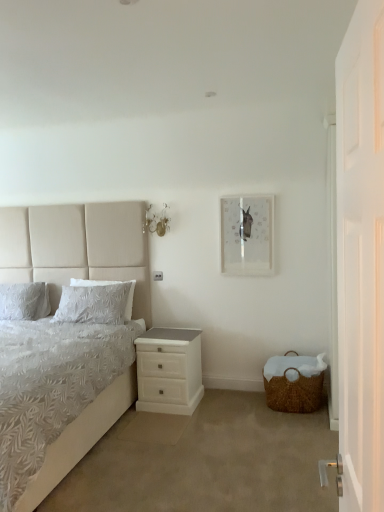
Measure the distance between point (348, 221) and camera.

Point (348, 221) and camera are 1.08 meters apart from each other.

This screenshot has width=384, height=512. I want to click on white glossy nightstand at lower center, so click(x=169, y=370).

I want to click on white textured bed at left, so click(77, 248).

What do you see at coordinates (77, 248) in the screenshot?
I see `white textured bed at left` at bounding box center [77, 248].

What do you see at coordinates (24, 301) in the screenshot?
I see `white textured pillow at left, which appears as the second pillow when viewed from the right` at bounding box center [24, 301].

In the scene shown: In order to face clear glass picture frame at upper center, should I rotate leftwards or rightwards?

To align with it, rotate right about 7.191°.

Locate an element on the screen. The width and height of the screenshot is (384, 512). white wooden door at right is located at coordinates (361, 256).

From a real-world perspective, relative to white textured pillow at left, which is counted as the 1th pillow, starting from the left, is white wooden door at right vertically above or below?

In terms of real-world spatial position, white wooden door at right is above white textured pillow at left, which is counted as the 1th pillow, starting from the left.

Consider the image. Is white wooden door at right shorter than white textured pillow at left, which is counted as the 1th pillow, starting from the left?

In fact, white wooden door at right may be taller than white textured pillow at left, which is counted as the 1th pillow, starting from the left.

Can we say white wooden door at right lies outside white textured pillow at left, which is counted as the 1th pillow, starting from the left?

That's correct, white wooden door at right is outside of white textured pillow at left, which is counted as the 1th pillow, starting from the left.

From the image's perspective, who appears lower, white wooden door at right or white textured pillow at left, which appears as the second pillow when viewed from the right?

From the image's view, white textured pillow at left, which appears as the second pillow when viewed from the right, is below.

Considering the sizes of woven brown basket at lower right and white textured pillow at left, which appears as the second pillow when viewed from the right, in the image, is woven brown basket at lower right taller or shorter than white textured pillow at left, which appears as the second pillow when viewed from the right,?

Considering their sizes, woven brown basket at lower right has less height than white textured pillow at left, which appears as the second pillow when viewed from the right.

From a real-world perspective, count 2nd pillows upward from the woven brown basket at lower right and point to it. Please provide its 2D coordinates.

[(24, 301)]

Looking at this image, from the image's perspective, is woven brown basket at lower right below white textured pillow at left, which appears as the second pillow when viewed from the right?

Yes, from the image's perspective, woven brown basket at lower right is below white textured pillow at left, which appears as the second pillow when viewed from the right.

Based on the photo, could you tell me if woven brown basket at lower right is facing white textured pillow at left, which is counted as the 1th pillow, starting from the left?

No, woven brown basket at lower right is not oriented towards white textured pillow at left, which is counted as the 1th pillow, starting from the left.

In terms of size, does woven brown basket at lower right appear bigger or smaller than white textured pillow at left, the first pillow when ordered from right to left?

Considering their sizes, woven brown basket at lower right takes up more space than white textured pillow at left, the first pillow when ordered from right to left.

Is woven brown basket at lower right directly adjacent to white textured pillow at left, which is counted as the second pillow, starting from the left?

No, woven brown basket at lower right is not making contact with white textured pillow at left, which is counted as the second pillow, starting from the left.

Is woven brown basket at lower right shorter than white textured pillow at left, which is counted as the second pillow, starting from the left?

Yes, woven brown basket at lower right is shorter than white textured pillow at left, which is counted as the second pillow, starting from the left.

Is clear glass picture frame at upper center aimed at white wooden door at right?

Yes, clear glass picture frame at upper center is facing white wooden door at right.

Considering the relative sizes of clear glass picture frame at upper center and white wooden door at right in the image provided, is clear glass picture frame at upper center taller than white wooden door at right?

In fact, clear glass picture frame at upper center may be shorter than white wooden door at right.

Is white wooden door at right completely or partially inside clear glass picture frame at upper center?

No, clear glass picture frame at upper center does not contain white wooden door at right.

Can you see clear glass picture frame at upper center touching white wooden door at right?

No, clear glass picture frame at upper center is not with white wooden door at right.

From the image's perspective, which one is positioned lower, white textured bed at left or white textured pillow at left, which appears as the second pillow when viewed from the right?

white textured bed at left.

Is white textured pillow at left, which appears as the second pillow when viewed from the right, at the back of white textured bed at left?

Correct, white textured bed at left is looking away from white textured pillow at left, which appears as the second pillow when viewed from the right.

Does white textured bed at left touch white textured pillow at left, which is counted as the 1th pillow, starting from the left?

They are not placed beside each other.

What's the angular difference between white textured pillow at left, which appears as the second pillow when viewed from the right, and white wooden door at right's facing directions?

white textured pillow at left, which appears as the second pillow when viewed from the right, and white wooden door at right are facing 85.2 degrees away from each other.

Is white textured pillow at left, which appears as the second pillow when viewed from the right, spatially inside white wooden door at right, or outside of it?

white textured pillow at left, which appears as the second pillow when viewed from the right, cannot be found inside white wooden door at right.

Considering their positions, is white textured pillow at left, which appears as the second pillow when viewed from the right, located in front of or behind white wooden door at right?

Clearly, white textured pillow at left, which appears as the second pillow when viewed from the right, is behind white wooden door at right.

Does point (39, 303) come behind point (361, 210)?

Yes, it is behind point (361, 210).

Considering the relative sizes of white textured bed at left and woven brown basket at lower right in the image provided, is white textured bed at left smaller than woven brown basket at lower right?

No.

From the image's perspective, between white textured bed at left and woven brown basket at lower right, who is located below?

woven brown basket at lower right is shown below in the image.

Is white textured bed at left to the left of woven brown basket at lower right from the viewer's perspective?

Yes, white textured bed at left is to the left of woven brown basket at lower right.

Which is farther, (41, 495) or (281, 376)?

The point (281, 376) is farther.

At what (x,y) coordinates should I click in order to perform the action: click on the 2nd pillow below the white wooden door at right (from the image's perspective). Please return your answer as a coordinate pair (x, y). Image resolution: width=384 pixels, height=512 pixels. Looking at the image, I should click on (24, 301).

This screenshot has height=512, width=384. I want to click on pillow that is the 2nd one when counting backward from the woven brown basket at lower right, so click(24, 301).

From the image, which object appears to be farther from white textured pillow at left, which is counted as the second pillow, starting from the left, white textured pillow at left, which appears as the second pillow when viewed from the right, or white glossy nightstand at lower center?

white glossy nightstand at lower center lies further to white textured pillow at left, which is counted as the second pillow, starting from the left, than the other object.

Looking at this image, considering their positions, is white textured pillow at left, which appears as the second pillow when viewed from the right, positioned further to woven brown basket at lower right than white wooden door at right?

The object further to woven brown basket at lower right is white wooden door at right.

Considering their positions, is white glossy nightstand at lower center positioned closer to clear glass picture frame at upper center than white wooden door at right?

white glossy nightstand at lower center.

Based on their spatial positions, is white wooden door at right or white textured pillow at left, which appears as the second pillow when viewed from the right, closer to clear glass picture frame at upper center?

white textured pillow at left, which appears as the second pillow when viewed from the right, is closer to clear glass picture frame at upper center.

Looking at the image, which one is located further to white textured pillow at left, which is counted as the second pillow, starting from the left, white textured bed at left or white glossy nightstand at lower center?

white glossy nightstand at lower center is further to white textured pillow at left, which is counted as the second pillow, starting from the left.

Looking at the image, which one is located further to clear glass picture frame at upper center, white textured pillow at left, which is counted as the 1th pillow, starting from the left, or white textured bed at left?

white textured pillow at left, which is counted as the 1th pillow, starting from the left, lies further to clear glass picture frame at upper center than the other object.

Based on their spatial positions, is white textured bed at left or white wooden door at right closer to white glossy nightstand at lower center?

white textured bed at left lies closer to white glossy nightstand at lower center than the other object.

Which object lies nearer to the anchor point white textured pillow at left, which appears as the second pillow when viewed from the right, woven brown basket at lower right or white textured pillow at left, the first pillow when ordered from right to left?

The object closer to white textured pillow at left, which appears as the second pillow when viewed from the right, is white textured pillow at left, the first pillow when ordered from right to left.

In order to click on picture frame positioned between white wooden door at right and white textured pillow at left, the first pillow when ordered from right to left, from near to far in this screenshot , I will do `click(247, 234)`.

I want to click on nightstand positioned between white wooden door at right and clear glass picture frame at upper center from near to far, so click(x=169, y=370).

Identify the location of basket between white wooden door at right and white glossy nightstand at lower center along the z-axis. (294, 382).

The width and height of the screenshot is (384, 512). What are the coordinates of `bed between white wooden door at right and white textured pillow at left, the first pillow when ordered from right to left, in the front-back direction` in the screenshot? It's located at (77, 248).